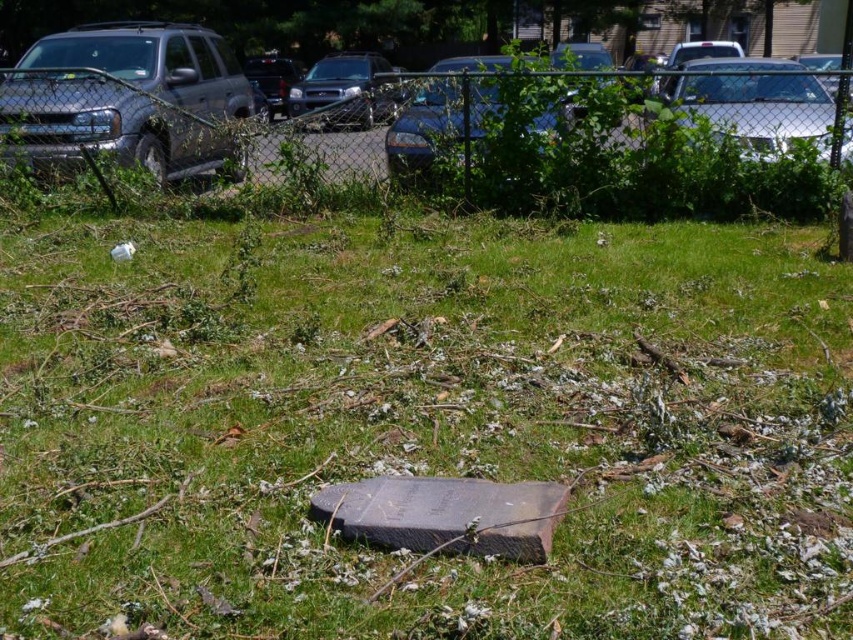
Question: Which of the following is the closest to the observer?

Choices:
 (A) (775, 81)
 (B) (567, 134)

Answer: (A)

Question: Which of the following is the closest to the observer?

Choices:
 (A) (492, 80)
 (B) (732, 108)
 (C) (296, 99)
 (D) (48, 140)

Answer: (A)

Question: Is brushed metal truck at left above metallic silver car at center?

Choices:
 (A) yes
 (B) no

Answer: (B)

Question: Among these points, which one is nearest to the camera?

Choices:
 (A) (653, 179)
 (B) (375, 115)
 (C) (68, 56)
 (D) (727, 124)

Answer: (D)

Question: Considering the relative positions of metallic chain-link fence at upper center and metallic silver car at center in the image provided, where is metallic chain-link fence at upper center located with respect to metallic silver car at center?

Choices:
 (A) above
 (B) below

Answer: (B)

Question: Does metallic chain-link fence at upper center appear under brushed metal truck at left?

Choices:
 (A) yes
 (B) no

Answer: (A)